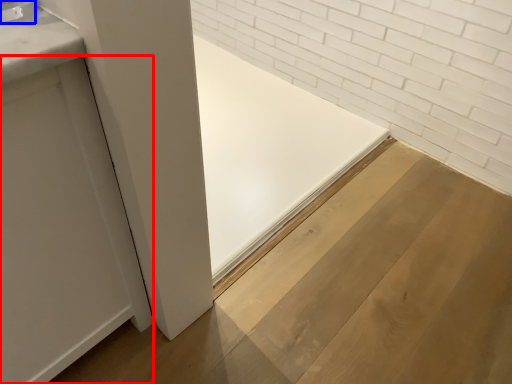
Question: Which object appears farthest to the camera in this image, door (highlighted by a red box) or faucet (highlighted by a blue box)?

Choices:
 (A) door
 (B) faucet

Answer: (B)